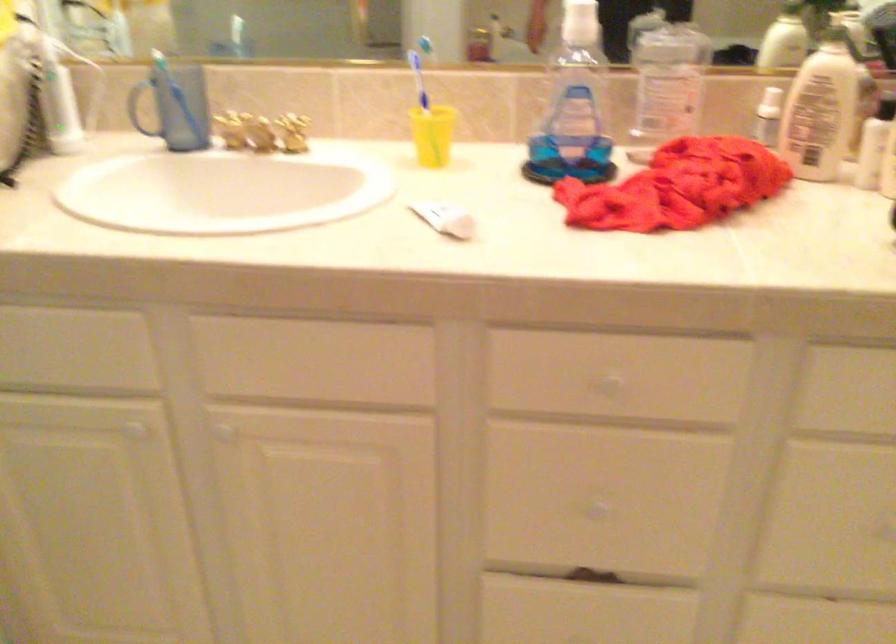
This screenshot has height=644, width=896. What are the coordinates of `blue cup handle` in the screenshot? It's located at (140, 106).